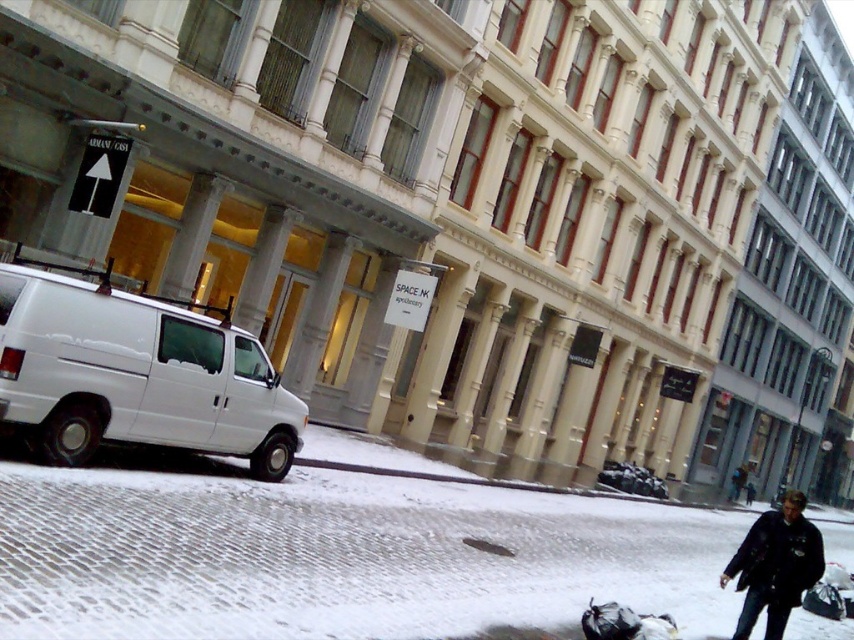
You are standing at the black leather jacket at lower right and want to reach the white matte van at left. Given that you can walk in a straight line, will you encounter any obstacles between them?

The white matte van at left is 6.62 meters away from the black leather jacket at lower right. Since there are no objects mentioned between them in the scene description, you can walk straight to the van without obstacles.

You are a delivery person trying to reach the entrance of the building. You see the snowy cobblestone pavement at lower left and the black leather jacket at lower right. Which path should you take to approach the building from the left side?

You should take the snowy cobblestone pavement at lower left because it is positioned to the left of the black leather jacket at lower right, aligning with the left side approach to the building.

You are standing at the point labeled as point (337, 556) in the image. What is the surface you are currently standing on?

The surface at point (337, 556) is snowy cobblestone pavement at lower left.